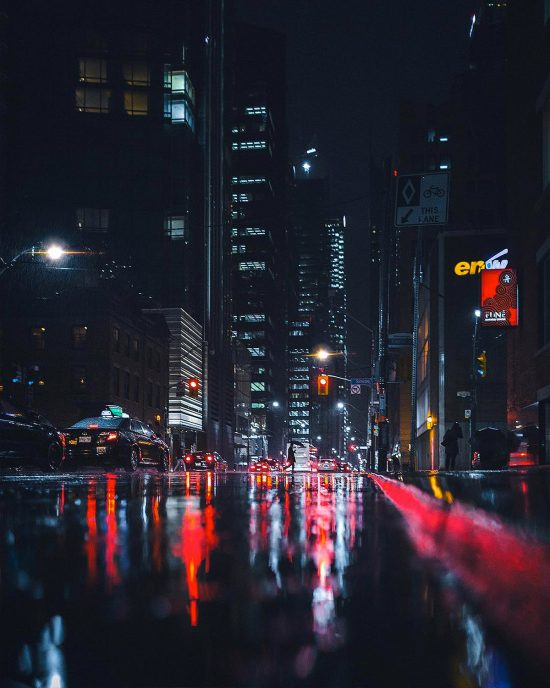
I want to click on lights, so click(x=178, y=526).